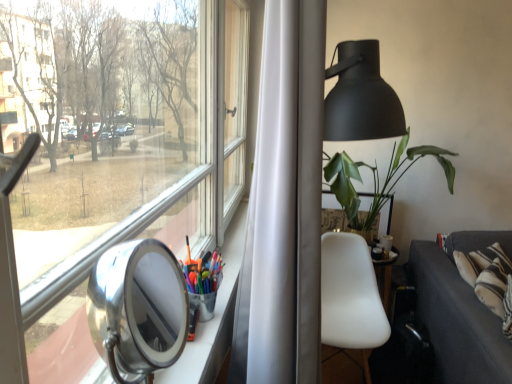
Question: Considering the positions of dark gray fabric couch at lower right and white matte chair at center-right in the image, is dark gray fabric couch at lower right wider or thinner than white matte chair at center-right?

Choices:
 (A) wide
 (B) thin

Answer: (A)

Question: Is point (504, 370) positioned closer to the camera than point (321, 339)?

Choices:
 (A) closer
 (B) farther

Answer: (B)

Question: Which object is the closest to the dark gray fabric couch at lower right?

Choices:
 (A) green matte plant at right
 (B) polished silver view mirror at lower left
 (C) matte black table lamp at upper right
 (D) white matte chair at center-right

Answer: (D)

Question: Estimate the real-world distances between objects in this image. Which object is closer to the green matte plant at right?

Choices:
 (A) white matte chair at center-right
 (B) polished silver view mirror at lower left
 (C) matte black table lamp at upper right
 (D) dark gray fabric couch at lower right

Answer: (C)